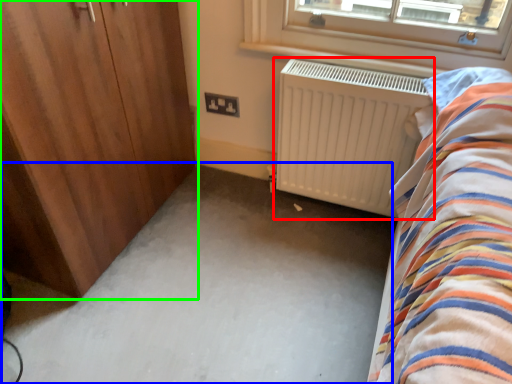
Question: Which is farther away from radiator (highlighted by a red box)? plain (highlighted by a blue box) or door (highlighted by a green box)?

Choices:
 (A) plain
 (B) door

Answer: (B)